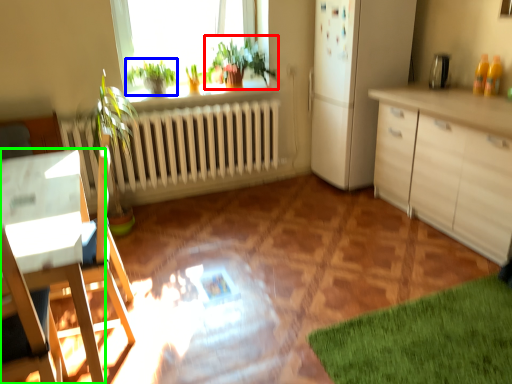
Question: Considering the real-world distances, which object is farthest from houseplant (highlighted by a red box)? plant (highlighted by a blue box) or desk (highlighted by a green box)?

Choices:
 (A) plant
 (B) desk

Answer: (B)